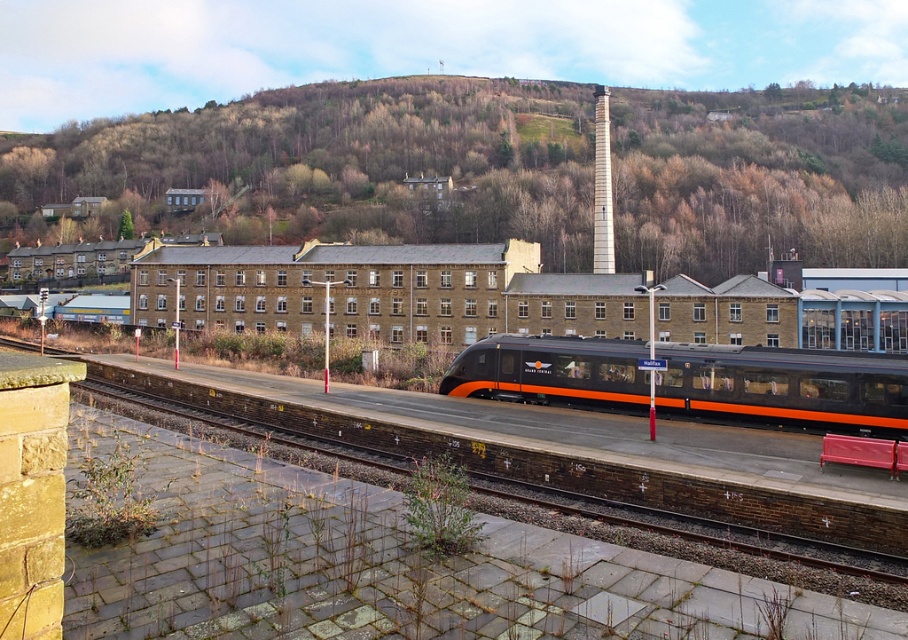
You are a passenger at the train station and want to board the matte black train at center. From your current position on the platform, which direction should you walk to avoid the brown textured hillside at upper center blocking your view?

The brown textured hillside at upper center is positioned over the matte black train at center, so you should walk to the sides of the matte black train at center to avoid the hillside blocking your view.

You are a passenger waiting at the train station. You notice the brown textured hillside at upper center and the matte black train at center. Which object is larger in size?

The brown textured hillside at upper center is bigger than the matte black train at center.

You are a passenger at the train station and want to board the matte black train at center. You notice a brown textured hillside at upper center in the background. Which direction should you walk relative to the hillside to reach the train?

The brown textured hillside at upper center is to the left of the matte black train at center, so you should walk to the right relative to the hillside to reach the train.